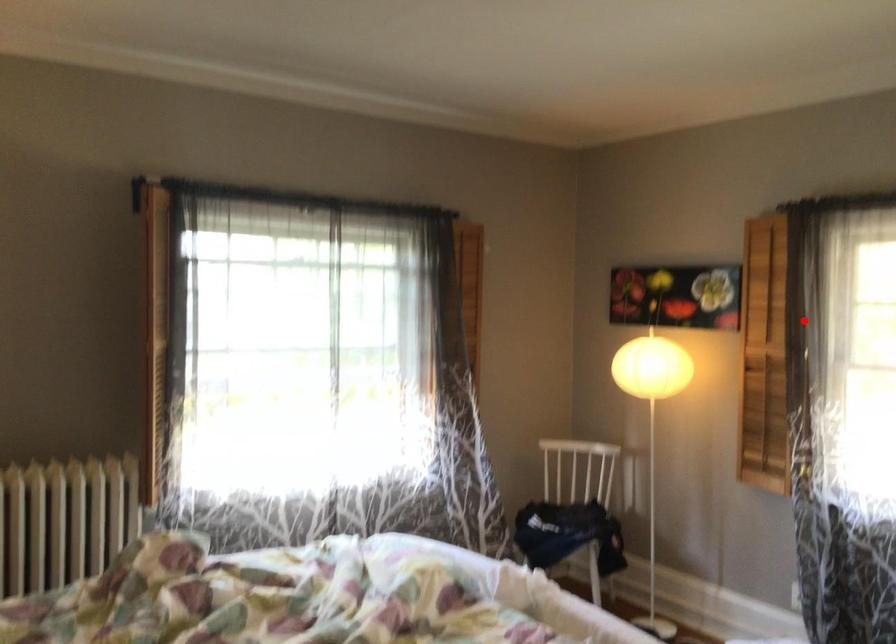
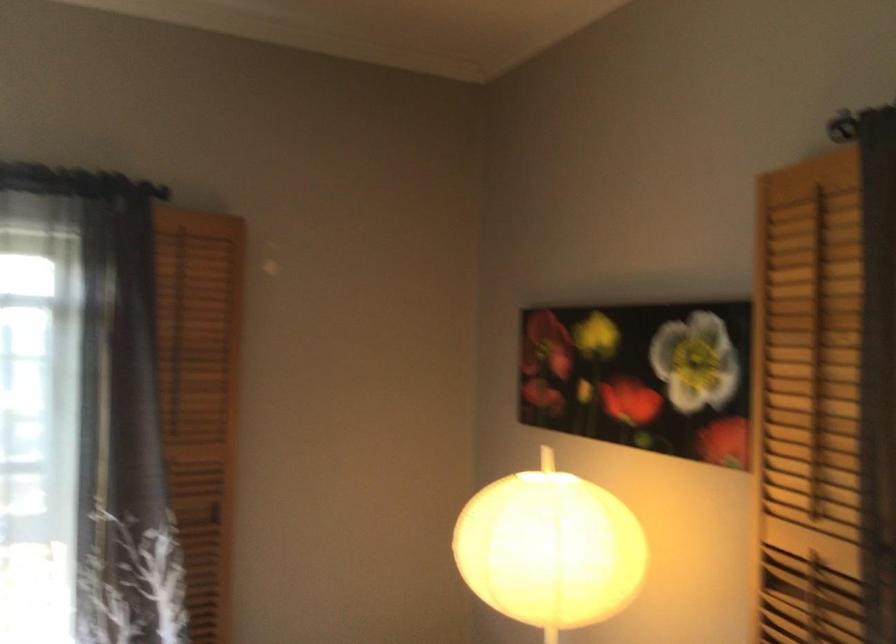
Question: A red point is marked in image1. In image2, is the corresponding 3D point closer to the camera or farther? Reply with the corresponding letter.

Choices:
 (A) The corresponding 3D point is closer.
 (B) The corresponding 3D point is farther.

Answer: (A)